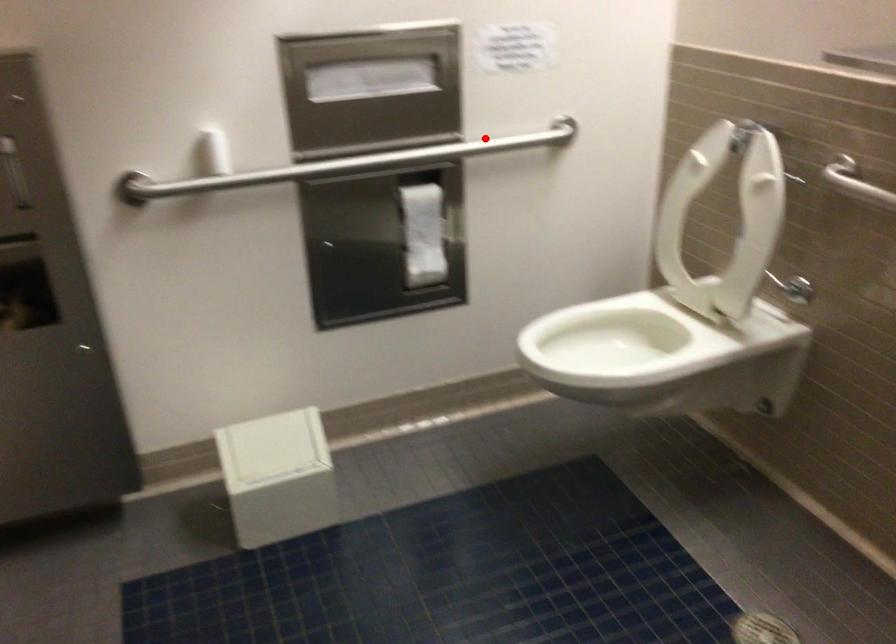
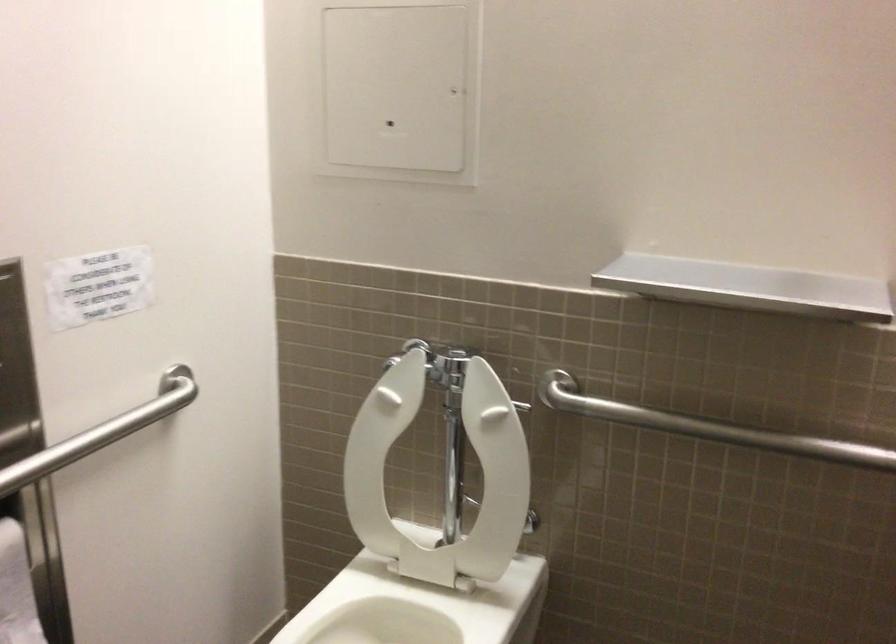
Find the pixel in the second image that matches the highlighted location in the first image.

(102, 431)